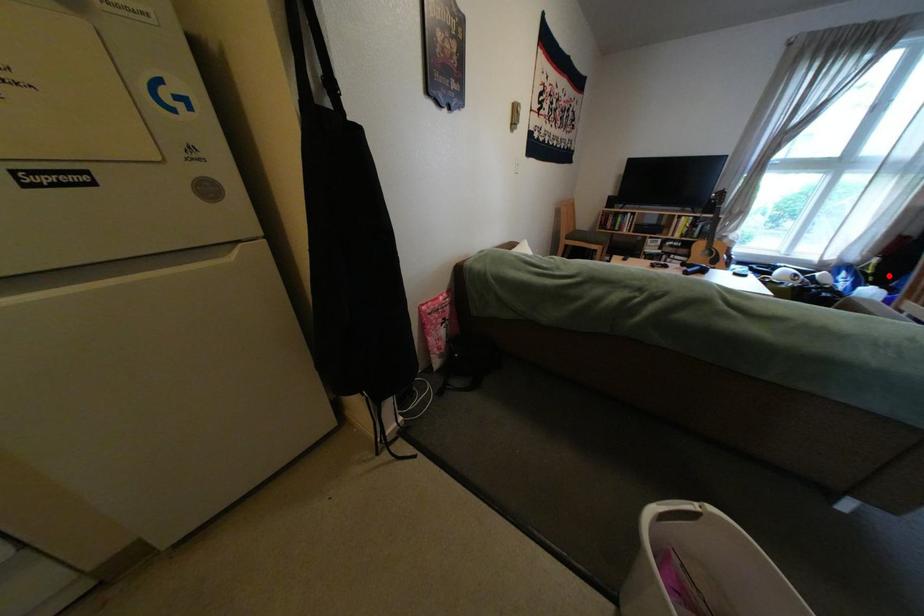
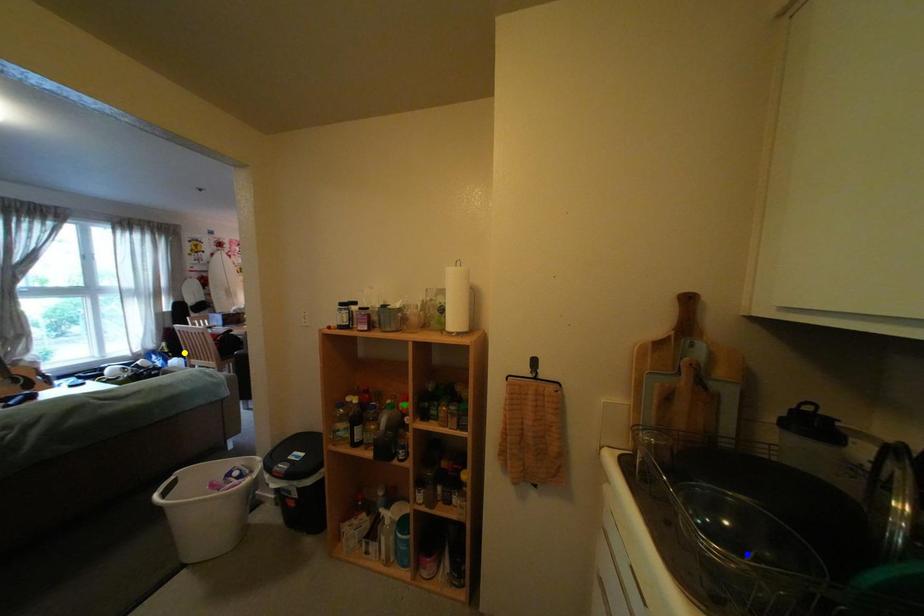
Question: I am providing you with two images of the same scene from different viewpoints. A red point is marked on the first image. You are given multiple points on the second image. Which spot in image 2 lines up with the point in image 1?

Choices:
 (A) green point
 (B) yellow point
 (C) blue point

Answer: (B)